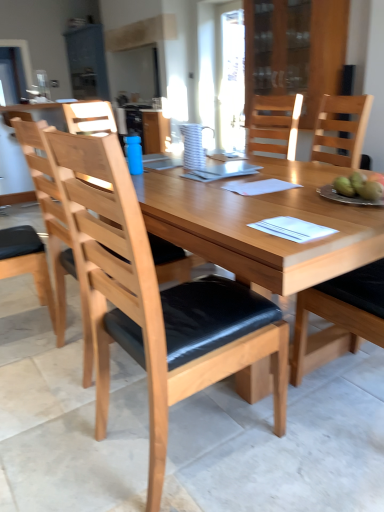
Locate an element on the screen. free space to the left of light brown wood chair at center, positioned as the 1th chair in left-to-right order is located at coordinates (36, 362).